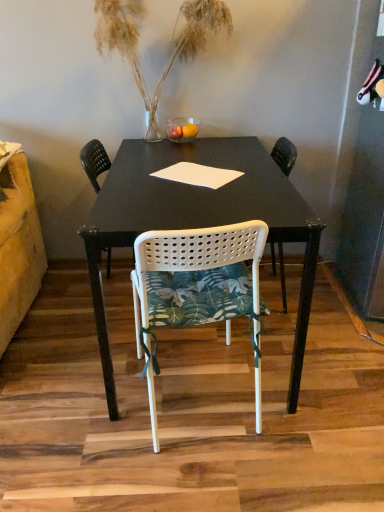
In order to face translucent glass vase at upper center, should I rotate leftwards or rightwards?

You should rotate left by 2.234 degrees.

The image size is (384, 512). What are the coordinates of `translucent glass vase at upper center` in the screenshot? It's located at (171, 40).

Is translucent glass vase at upper center positioned beyond the bounds of white perforated plastic chair at center, which is counted as the second chair, starting from the back?

That's correct, translucent glass vase at upper center is outside of white perforated plastic chair at center, which is counted as the second chair, starting from the back.

From their relative heights in the image, would you say translucent glass vase at upper center is taller or shorter than white perforated plastic chair at center, which is counted as the second chair, starting from the back?

Considering their sizes, translucent glass vase at upper center has less height than white perforated plastic chair at center, which is counted as the second chair, starting from the back.

Between translucent glass vase at upper center and white perforated plastic chair at center, which is counted as the second chair, starting from the back, which one has larger size?

Bigger between the two is white perforated plastic chair at center, which is counted as the second chair, starting from the back.

What are the coordinates of `houseplant above the white perforated plastic chair at center, positioned as the 1th chair in front-to-back order (from the image's perspective)` in the screenshot? It's located at (171, 40).

Considering the sizes of objects white perforated plastic chair at center, which is counted as the second chair, starting from the back, and white perforated plastic chair at center, the second chair viewed from the front, in the image provided, who is taller, white perforated plastic chair at center, which is counted as the second chair, starting from the back, or white perforated plastic chair at center, the second chair viewed from the front,?

white perforated plastic chair at center, the second chair viewed from the front, is taller.

Between white perforated plastic chair at center, positioned as the 1th chair in front-to-back order, and white perforated plastic chair at center, arranged as the 1th chair when viewed from the back, which one appears on the left side from the viewer's perspective?

From the viewer's perspective, white perforated plastic chair at center, arranged as the 1th chair when viewed from the back, appears more on the left side.

From a real-world perspective, is white perforated plastic chair at center, positioned as the 1th chair in front-to-back order, on white perforated plastic chair at center, the second chair viewed from the front?

Correct, in the physical world, white perforated plastic chair at center, positioned as the 1th chair in front-to-back order, is higher than white perforated plastic chair at center, the second chair viewed from the front.

Does point (253, 313) lie in front of point (108, 274)?

Yes, it is.

Which of these two, translucent glass vase at upper center or white perforated plastic chair at center, the second chair viewed from the front, is bigger?

white perforated plastic chair at center, the second chair viewed from the front, is bigger.

Choose the correct answer: Is translucent glass vase at upper center inside white perforated plastic chair at center, arranged as the 1th chair when viewed from the back, or outside it?

translucent glass vase at upper center is located beyond the bounds of white perforated plastic chair at center, arranged as the 1th chair when viewed from the back.

How much distance is there between translucent glass vase at upper center and white perforated plastic chair at center, the second chair viewed from the front?

A distance of 21.25 inches exists between translucent glass vase at upper center and white perforated plastic chair at center, the second chair viewed from the front.

Is point (220, 4) closer to camera compared to point (86, 172)?

Yes, it is in front of point (86, 172).

Is white perforated plastic chair at center, which is counted as the second chair, starting from the back, wider or thinner than translucent glass vase at upper center?

white perforated plastic chair at center, which is counted as the second chair, starting from the back, is wider than translucent glass vase at upper center.

From the image's perspective, between white perforated plastic chair at center, positioned as the 1th chair in front-to-back order, and translucent glass vase at upper center, who is located below?

white perforated plastic chair at center, positioned as the 1th chair in front-to-back order, from the image's perspective.

Locate an element on the screen. The width and height of the screenshot is (384, 512). houseplant behind the white perforated plastic chair at center, which is counted as the second chair, starting from the back is located at coordinates (171, 40).

Which point is more distant from viewer, (251, 313) or (108, 1)?

The point (108, 1) is more distant.

How many degrees apart are the facing directions of white perforated plastic chair at center, the second chair viewed from the front, and translucent glass vase at upper center?

white perforated plastic chair at center, the second chair viewed from the front, and translucent glass vase at upper center are facing 84.4 degrees away from each other.

Locate an element on the screen. This screenshot has height=512, width=384. houseplant that appears above the white perforated plastic chair at center, the second chair viewed from the front (from a real-world perspective) is located at coordinates (171, 40).

Between white perforated plastic chair at center, arranged as the 1th chair when viewed from the back, and translucent glass vase at upper center, which one has larger width?

Wider between the two is white perforated plastic chair at center, arranged as the 1th chair when viewed from the back.

Is white perforated plastic chair at center, the second chair viewed from the front, facing towards translucent glass vase at upper center?

No, white perforated plastic chair at center, the second chair viewed from the front, is not turned towards translucent glass vase at upper center.

Considering the positions of objects white perforated plastic chair at center, arranged as the 1th chair when viewed from the back, and white perforated plastic chair at center, positioned as the 1th chair in front-to-back order, in the image provided, who is in front, white perforated plastic chair at center, arranged as the 1th chair when viewed from the back, or white perforated plastic chair at center, positioned as the 1th chair in front-to-back order,?

white perforated plastic chair at center, positioned as the 1th chair in front-to-back order, is closer to the camera.

How many degrees apart are the facing directions of white perforated plastic chair at center, the second chair viewed from the front, and white perforated plastic chair at center, positioned as the 1th chair in front-to-back order?

106 degrees separate the facing orientations of white perforated plastic chair at center, the second chair viewed from the front, and white perforated plastic chair at center, positioned as the 1th chair in front-to-back order.

In the scene shown: Can you confirm if white perforated plastic chair at center, the second chair viewed from the front, is taller than white perforated plastic chair at center, positioned as the 1th chair in front-to-back order?

Yes.

Is white perforated plastic chair at center, the second chair viewed from the front, aimed at white perforated plastic chair at center, which is counted as the second chair, starting from the back?

No, white perforated plastic chair at center, the second chair viewed from the front, does not turn towards white perforated plastic chair at center, which is counted as the second chair, starting from the back.

Where is `chair that is the 2nd one when counting downward from the translucent glass vase at upper center (from the image's perspective)`? The height and width of the screenshot is (512, 384). chair that is the 2nd one when counting downward from the translucent glass vase at upper center (from the image's perspective) is located at coordinates (197, 289).

At what (x,y) coordinates should I click in order to perform the action: click on chair on the right of white perforated plastic chair at center, the second chair viewed from the front. Please return your answer as a coordinate pair (x, y). This screenshot has height=512, width=384. Looking at the image, I should click on (197, 289).

Based on their spatial positions, is white perforated plastic chair at center, the second chair viewed from the front, or white perforated plastic chair at center, which is counted as the second chair, starting from the back, further from translucent glass vase at upper center?

white perforated plastic chair at center, which is counted as the second chair, starting from the back, lies further to translucent glass vase at upper center than the other object.

Considering their positions, is white perforated plastic chair at center, the second chair viewed from the front, positioned closer to white perforated plastic chair at center, which is counted as the second chair, starting from the back, than translucent glass vase at upper center?

Based on the image, translucent glass vase at upper center appears to be nearer to white perforated plastic chair at center, which is counted as the second chair, starting from the back.

From the image, which object appears to be farther from translucent glass vase at upper center, white perforated plastic chair at center, positioned as the 1th chair in front-to-back order, or white perforated plastic chair at center, arranged as the 1th chair when viewed from the back?

The object further to translucent glass vase at upper center is white perforated plastic chair at center, positioned as the 1th chair in front-to-back order.

Which object lies nearer to the anchor point white perforated plastic chair at center, arranged as the 1th chair when viewed from the back, white perforated plastic chair at center, which is counted as the second chair, starting from the back, or translucent glass vase at upper center?

translucent glass vase at upper center.

Which object lies further to the anchor point white perforated plastic chair at center, the second chair viewed from the front, translucent glass vase at upper center or white perforated plastic chair at center, which is counted as the second chair, starting from the back?

white perforated plastic chair at center, which is counted as the second chair, starting from the back.

When comparing their distances from white perforated plastic chair at center, which is counted as the second chair, starting from the back, does translucent glass vase at upper center or white perforated plastic chair at center, arranged as the 1th chair when viewed from the back, seem further?

Among the two, white perforated plastic chair at center, arranged as the 1th chair when viewed from the back, is located further to white perforated plastic chair at center, which is counted as the second chair, starting from the back.

The image size is (384, 512). I want to click on chair that lies between translucent glass vase at upper center and white perforated plastic chair at center, which is counted as the second chair, starting from the back, from top to bottom, so click(94, 162).